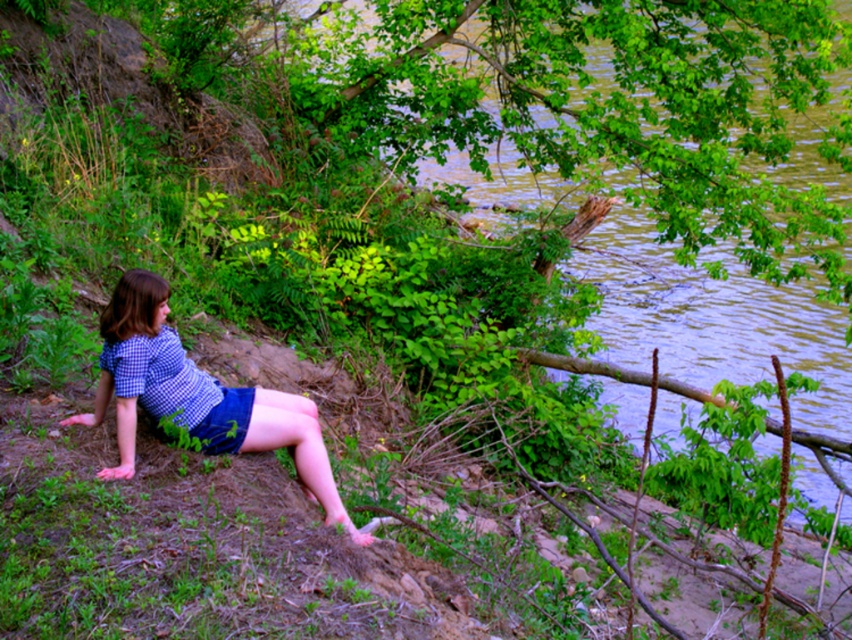
Question: Is blue checkered shirt at center bigger than blue denim shorts at lower center?

Choices:
 (A) yes
 (B) no

Answer: (A)

Question: Observing the image, what is the correct spatial positioning of blue checkered shirt at center in reference to blue denim shorts at lower center?

Choices:
 (A) below
 (B) above

Answer: (A)

Question: Which point is closer to the camera?

Choices:
 (A) blue denim shorts at lower center
 (B) blue checkered shirt at center

Answer: (B)

Question: Does blue checkered shirt at center appear on the left side of blue denim shorts at lower center?

Choices:
 (A) yes
 (B) no

Answer: (A)

Question: Among these objects, which one is farthest from the camera?

Choices:
 (A) blue denim shorts at lower center
 (B) blue checkered shirt at center

Answer: (A)